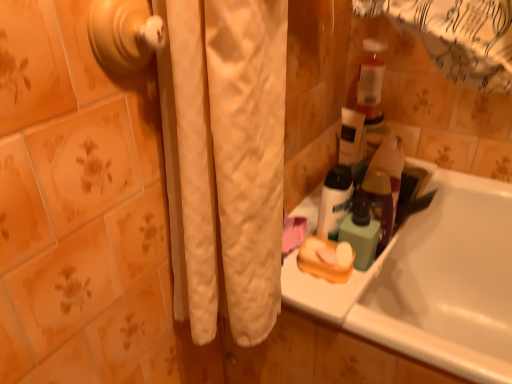
Question: Is white matte bottle at upper right closer to camera compared to green matte bottle at upper right?

Choices:
 (A) yes
 (B) no

Answer: (B)

Question: Is white matte bottle at upper right located outside green matte bottle at upper right?

Choices:
 (A) no
 (B) yes

Answer: (B)

Question: From the image's perspective, is white matte bottle at upper right on top of green matte bottle at upper right?

Choices:
 (A) no
 (B) yes

Answer: (B)

Question: Is green matte bottle at upper right at the back of white matte bottle at upper right?

Choices:
 (A) yes
 (B) no

Answer: (A)

Question: Can green matte bottle at upper right be found inside white matte bottle at upper right?

Choices:
 (A) yes
 (B) no

Answer: (B)

Question: Is white glossy bathtub at lower right to the left or to the right of white matte bottle at upper right in the image?

Choices:
 (A) left
 (B) right

Answer: (B)

Question: From a real-world perspective, relative to white matte bottle at upper right, is white glossy bathtub at lower right vertically above or below?

Choices:
 (A) above
 (B) below

Answer: (B)

Question: From the image's perspective, is white glossy bathtub at lower right positioned above or below white matte bottle at upper right?

Choices:
 (A) below
 (B) above

Answer: (A)

Question: In terms of height, does white glossy bathtub at lower right look taller or shorter compared to white matte bottle at upper right?

Choices:
 (A) tall
 (B) short

Answer: (A)

Question: Based on their positions, is green matte bottle at upper right located to the left or right of gold metallic door handle at upper left?

Choices:
 (A) right
 (B) left

Answer: (A)

Question: Considering the positions of green matte bottle at upper right and gold metallic door handle at upper left in the image, is green matte bottle at upper right taller or shorter than gold metallic door handle at upper left?

Choices:
 (A) short
 (B) tall

Answer: (B)

Question: Would you say green matte bottle at upper right is inside or outside gold metallic door handle at upper left?

Choices:
 (A) outside
 (B) inside

Answer: (A)

Question: Based on their sizes in the image, would you say green matte bottle at upper right is bigger or smaller than gold metallic door handle at upper left?

Choices:
 (A) small
 (B) big

Answer: (B)

Question: Considering the positions of gold metallic door handle at upper left and white glossy bathtub at lower right in the image, is gold metallic door handle at upper left taller or shorter than white glossy bathtub at lower right?

Choices:
 (A) tall
 (B) short

Answer: (B)

Question: Based on their sizes in the image, would you say gold metallic door handle at upper left is bigger or smaller than white glossy bathtub at lower right?

Choices:
 (A) small
 (B) big

Answer: (A)